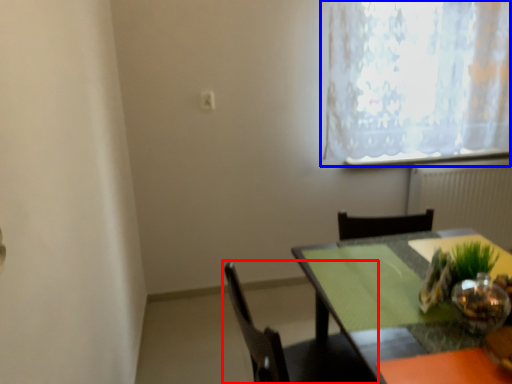
Question: Which object appears farthest to the camera in this image, chair (highlighted by a red box) or window (highlighted by a blue box)?

Choices:
 (A) chair
 (B) window

Answer: (B)